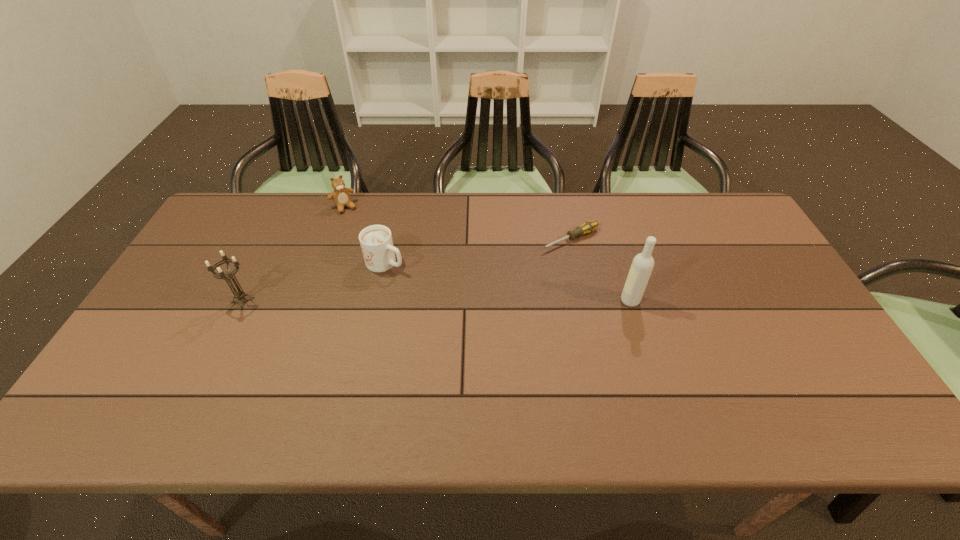
The height and width of the screenshot is (540, 960). Identify the location of vacant space on the desktop that is between the candle holder and the tallest object and is positioned at the tip of the screwdriver. (439, 300).

At what (x,y) coordinates should I click in order to perform the action: click on free spot on the desktop that is between the candle holder and the vodka and is positioned on the side with the handle of the third object from left to right. Please return your answer as a coordinate pair (x, y). The height and width of the screenshot is (540, 960). Looking at the image, I should click on tap(457, 300).

In order to click on free space on the desktop that is between the second tallest object and the tallest object and is positioned on the front-facing side of the farthest object in this screenshot , I will do `click(405, 300)`.